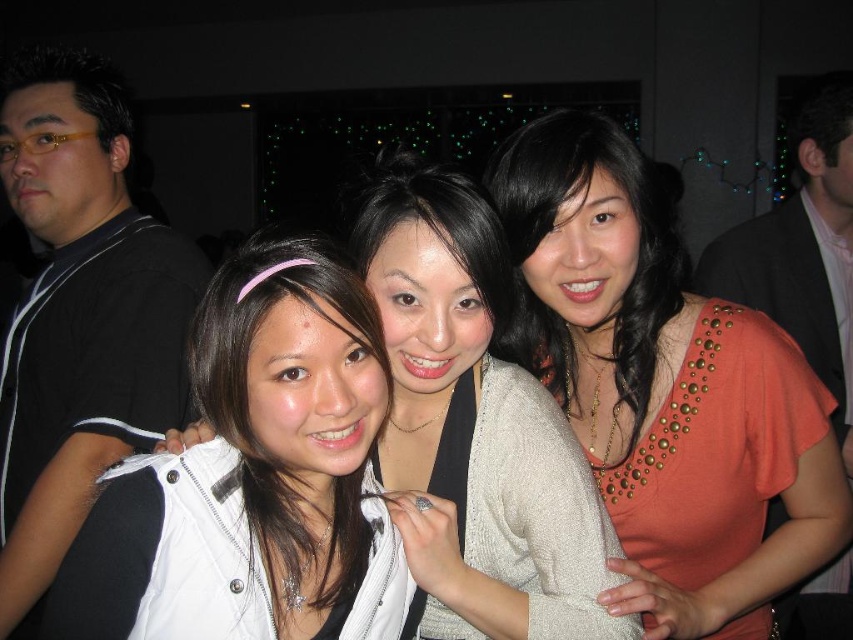
Does white fabric jacket at center appear under black matte shirt at left?

Yes.

Can you confirm if white fabric jacket at center is positioned to the left of black matte shirt at left?

In fact, white fabric jacket at center is to the right of black matte shirt at left.

You are a GUI agent. You are given a task and a screenshot of the screen. Output one action in this format:
    pyautogui.click(x=<x>, y=<y>)
    Task: Click on the white fabric jacket at center
    
    Given the screenshot: What is the action you would take?
    pyautogui.click(x=254, y=477)

Between point (635, 445) and point (814, 120), which one is positioned behind?

Point (814, 120)

Which is below, orange studded top at center or black suit jacket at upper right?

Positioned lower is orange studded top at center.

Locate an element on the screen. This screenshot has width=853, height=640. orange studded top at center is located at coordinates (666, 388).

Is orange studded top at center above white fabric jacket at center?

Yes.

Is orange studded top at center thinner than white fabric jacket at center?

In fact, orange studded top at center might be wider than white fabric jacket at center.

Where is `orange studded top at center`? Image resolution: width=853 pixels, height=640 pixels. orange studded top at center is located at coordinates (666, 388).